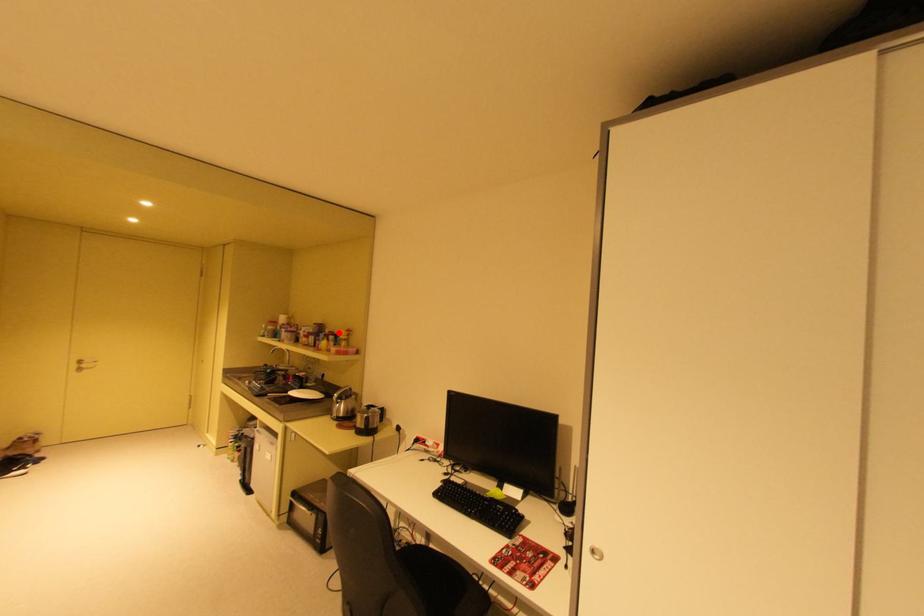
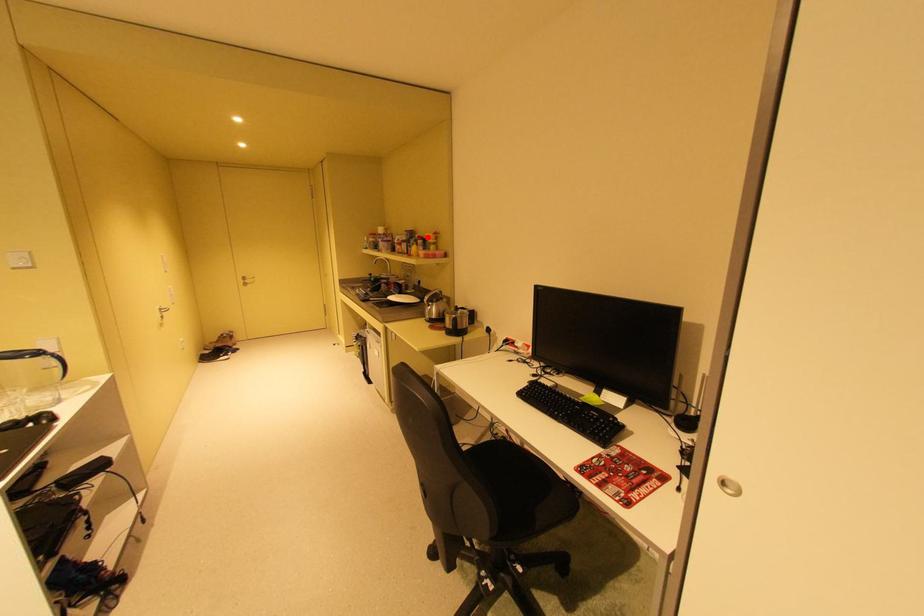
I am providing you with two images of the same scene from different viewpoints. A red point is marked on the first image and another point is marked on the second image. Is the red point in image1 aligned with the point shown in image2?

Yes